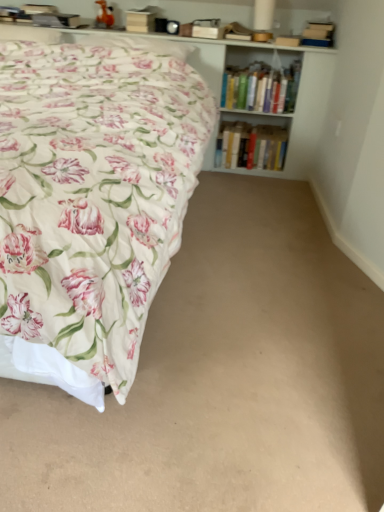
Describe the element at coordinates (297, 90) in the screenshot. This screenshot has height=512, width=384. I see `white wooden bookcase at upper center` at that location.

The height and width of the screenshot is (512, 384). Describe the element at coordinates (225, 378) in the screenshot. I see `beige carpet at lower center` at that location.

You are a GUI agent. You are given a task and a screenshot of the screen. Output one action in this format:
    pyautogui.click(x=<x>, y=<y>)
    Task: Click on the white wooden bookcase at upper center
    This screenshot has height=512, width=384.
    Given the screenshot: What is the action you would take?
    pyautogui.click(x=297, y=90)

In the scene shown: From a real-world perspective, is hardcover books at center, the second book from the top, positioned above or below white wooden bookcase at upper center?

Clearly, from a real-world perspective, hardcover books at center, the second book from the top, is below white wooden bookcase at upper center.

Is the surface of hardcover books at center, the second book from the top, in direct contact with white wooden bookcase at upper center?

No, hardcover books at center, the second book from the top, is not making contact with white wooden bookcase at upper center.

You are a GUI agent. You are given a task and a screenshot of the screen. Output one action in this format:
    pyautogui.click(x=<x>, y=<y>)
    Task: Click on the book below the white wooden bookcase at upper center (from a real-world perspective)
    The height and width of the screenshot is (512, 384).
    Given the screenshot: What is the action you would take?
    pyautogui.click(x=250, y=146)

What's the angular difference between hardcover books at center, the second book from the top, and white wooden bookcase at upper center's facing directions?

The angular difference between hardcover books at center, the second book from the top, and white wooden bookcase at upper center is 0.189 degrees.

Is white wooden bookcase at upper center to the right of floral cotton bed at left from the viewer's perspective?

Yes.

In the image, there is a white wooden bookcase at upper center. At what (x,y) coordinates should I click in order to perform the action: click on bed below it (from a real-world perspective). Please return your answer as a coordinate pair (x, y). The height and width of the screenshot is (512, 384). Looking at the image, I should click on (91, 202).

Which of these two, white wooden bookcase at upper center or floral cotton bed at left, is wider?

With larger width is floral cotton bed at left.

Considering the positions of objects floral cotton bed at left and white wooden bookcase at upper center in the image provided, who is in front, floral cotton bed at left or white wooden bookcase at upper center?

floral cotton bed at left is in front.

Between floral cotton bed at left and white wooden bookcase at upper center, which one has smaller width?

Thinner between the two is white wooden bookcase at upper center.

Is floral cotton bed at left facing away from white wooden bookcase at upper center?

Absolutely, floral cotton bed at left is directed away from white wooden bookcase at upper center.

From a real-world perspective, is floral cotton bed at left physically below white wooden bookcase at upper center?

Correct, in the physical world, floral cotton bed at left is lower than white wooden bookcase at upper center.

Considering their positions, is hardcover books at upper right, which appears as the 2th book when ordered from the bottom, located in front of or behind hardcover books at center, positioned as the first book in bottom-to-top order?

Visually, hardcover books at upper right, which appears as the 2th book when ordered from the bottom, is located in front of hardcover books at center, positioned as the first book in bottom-to-top order.

Locate an element on the screen. The image size is (384, 512). book below the hardcover books at upper right, which appears as the 2th book when ordered from the bottom (from a real-world perspective) is located at coordinates (250, 146).

From the image's perspective, is hardcover books at upper right, the 1th book viewed from the top, under hardcover books at center, positioned as the first book in bottom-to-top order?

Incorrect, from the image's perspective, hardcover books at upper right, the 1th book viewed from the top, is higher than hardcover books at center, positioned as the first book in bottom-to-top order.

Is hardcover books at upper right, which appears as the 2th book when ordered from the bottom, positioned far away from hardcover books at center, positioned as the first book in bottom-to-top order?

No.

Which object is wider, beige carpet at lower center or white wooden bookcase at upper center?

With larger width is beige carpet at lower center.

Who is shorter, beige carpet at lower center or white wooden bookcase at upper center?

beige carpet at lower center is shorter.

Is white wooden bookcase at upper center at the back of beige carpet at lower center?

No, beige carpet at lower center is not facing the opposite direction of white wooden bookcase at upper center.

In the scene shown: Is hardcover books at center, positioned as the first book in bottom-to-top order, taller or shorter than hardcover books at upper right, which appears as the 2th book when ordered from the bottom?

In the image, hardcover books at center, positioned as the first book in bottom-to-top order, appears to be shorter than hardcover books at upper right, which appears as the 2th book when ordered from the bottom.

Is hardcover books at upper right, the 1th book viewed from the top, located within hardcover books at center, positioned as the first book in bottom-to-top order?

That's incorrect, hardcover books at upper right, the 1th book viewed from the top, is not inside hardcover books at center, positioned as the first book in bottom-to-top order.

From a real-world perspective, is hardcover books at center, positioned as the first book in bottom-to-top order, physically below hardcover books at upper right, which appears as the 2th book when ordered from the bottom?

Yes, from a real-world perspective, hardcover books at center, positioned as the first book in bottom-to-top order, is below hardcover books at upper right, which appears as the 2th book when ordered from the bottom.

The height and width of the screenshot is (512, 384). I want to click on book above the hardcover books at center, the second book from the top (from a real-world perspective), so click(x=261, y=88).

Can you confirm if floral cotton bed at left is taller than beige carpet at lower center?

Yes, floral cotton bed at left is taller than beige carpet at lower center.

From the image's perspective, is floral cotton bed at left above or below beige carpet at lower center?

Clearly, from the image's perspective, floral cotton bed at left is above beige carpet at lower center.

Is beige carpet at lower center a part of floral cotton bed at left?

That's incorrect, beige carpet at lower center is not inside floral cotton bed at left.

Considering the sizes of floral cotton bed at left and beige carpet at lower center in the image, is floral cotton bed at left bigger or smaller than beige carpet at lower center?

In the image, floral cotton bed at left appears to be larger than beige carpet at lower center.

Locate an element on the screen. the 1st book to the right of the white wooden bookcase at upper center, starting your count from the anchor is located at coordinates (250, 146).

Identify the location of bookcase that is above the floral cotton bed at left (from a real-world perspective). click(x=297, y=90).

Considering their positions, is beige carpet at lower center positioned closer to white wooden bookcase at upper center than floral cotton bed at left?

The object closer to white wooden bookcase at upper center is floral cotton bed at left.

From the image, which object appears to be nearer to beige carpet at lower center, hardcover books at center, positioned as the first book in bottom-to-top order, or floral cotton bed at left?

The object closer to beige carpet at lower center is floral cotton bed at left.

Based on their spatial positions, is beige carpet at lower center or hardcover books at upper right, the 1th book viewed from the top, further from floral cotton bed at left?

hardcover books at upper right, the 1th book viewed from the top, is positioned further to the anchor floral cotton bed at left.

Based on their spatial positions, is hardcover books at center, positioned as the first book in bottom-to-top order, or beige carpet at lower center further from white wooden bookcase at upper center?

The object further to white wooden bookcase at upper center is beige carpet at lower center.

When comparing their distances from hardcover books at center, positioned as the first book in bottom-to-top order, does beige carpet at lower center or white wooden bookcase at upper center seem further?

beige carpet at lower center is positioned further to the anchor hardcover books at center, positioned as the first book in bottom-to-top order.

Which object lies nearer to the anchor point hardcover books at center, the second book from the top, white wooden bookcase at upper center or floral cotton bed at left?

white wooden bookcase at upper center is closer to hardcover books at center, the second book from the top.

Estimate the real-world distances between objects in this image. Which object is further from white wooden bookcase at upper center, floral cotton bed at left or hardcover books at upper right, which appears as the 2th book when ordered from the bottom?

floral cotton bed at left lies further to white wooden bookcase at upper center than the other object.

Based on their spatial positions, is beige carpet at lower center or hardcover books at center, the second book from the top, closer to floral cotton bed at left?

beige carpet at lower center is positioned closer to the anchor floral cotton bed at left.

Where is `bookcase between beige carpet at lower center and hardcover books at center, the second book from the top, along the z-axis`? The image size is (384, 512). bookcase between beige carpet at lower center and hardcover books at center, the second book from the top, along the z-axis is located at coordinates (297, 90).

Locate an element on the screen. The width and height of the screenshot is (384, 512). bookcase between beige carpet at lower center and hardcover books at upper right, which appears as the 2th book when ordered from the bottom, from front to back is located at coordinates (297, 90).

Where is `plain positioned between floral cotton bed at left and hardcover books at center, positioned as the first book in bottom-to-top order, from near to far`? plain positioned between floral cotton bed at left and hardcover books at center, positioned as the first book in bottom-to-top order, from near to far is located at coordinates (225, 378).

Where is `plain between floral cotton bed at left and white wooden bookcase at upper center in the front-back direction`? plain between floral cotton bed at left and white wooden bookcase at upper center in the front-back direction is located at coordinates (225, 378).